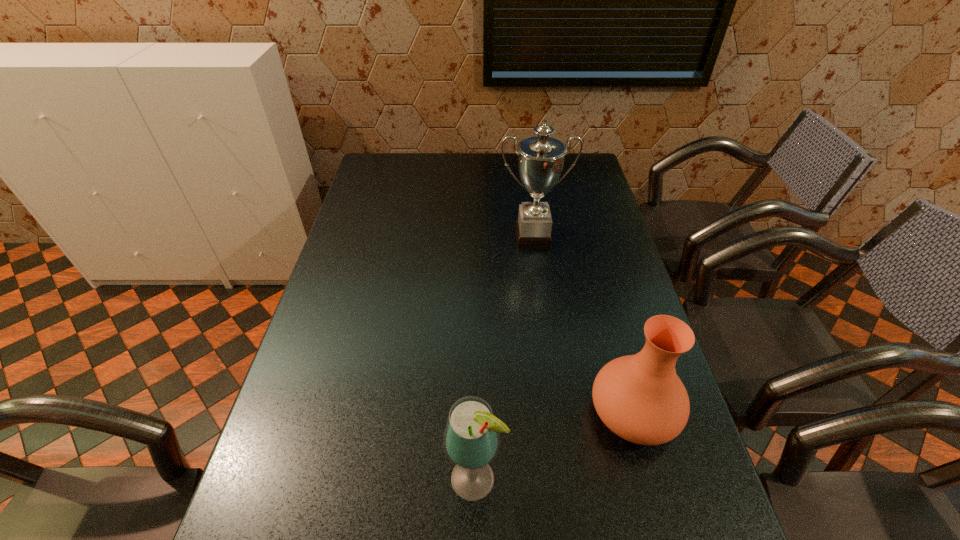
This screenshot has height=540, width=960. In order to click on trophy cup in this screenshot , I will do `click(541, 158)`.

At what (x,y) coordinates should I click in order to perform the action: click on the farthest object. Please return your answer as a coordinate pair (x, y). Looking at the image, I should click on (541, 158).

Where is `alcohol`? This screenshot has width=960, height=540. alcohol is located at coordinates (471, 442).

Locate an element on the screen. vase is located at coordinates (640, 398).

In order to click on free space located 0.210m at the front view of the tallest object in this screenshot , I will do 541,298.

Locate an element on the screen. Image resolution: width=960 pixels, height=540 pixels. vacant space situated on the right of the alcohol is located at coordinates (674, 480).

Locate an element on the screen. This screenshot has height=540, width=960. free location located 0.140m on the back of the vase is located at coordinates (611, 330).

The image size is (960, 540). What are the coordinates of `object located at the right edge` in the screenshot? It's located at [x=640, y=398].

Where is `free region at the far edge of the desktop`? This screenshot has width=960, height=540. free region at the far edge of the desktop is located at coordinates (467, 178).

In the image, there is a desktop. Where is `vacant space at the right edge`? This screenshot has width=960, height=540. vacant space at the right edge is located at coordinates click(596, 268).